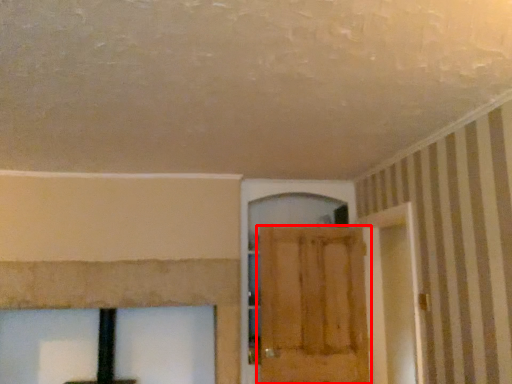
Question: From the image's perspective, where is door (annotated by the red box) located in relation to screen door in the image?

Choices:
 (A) above
 (B) below

Answer: (B)